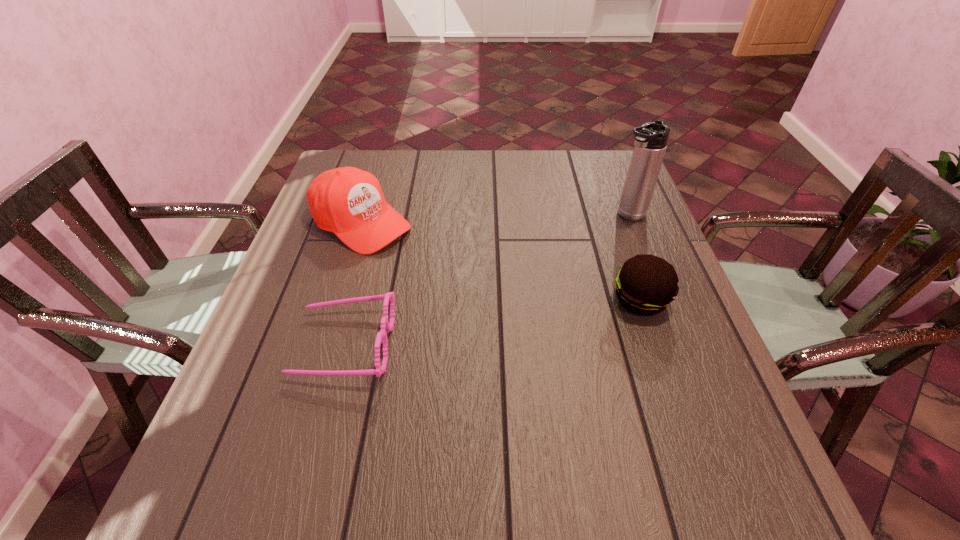
This screenshot has width=960, height=540. I want to click on free space on the desktop that is between the spectacles and the second shortest object and is positioned on the handle side of the thermos bottle, so click(x=463, y=326).

Locate an element on the screen. The width and height of the screenshot is (960, 540). vacant space on the desktop that is between the shortest object and the second shortest object and is positioned on the front panel of the baseball cap is located at coordinates (514, 319).